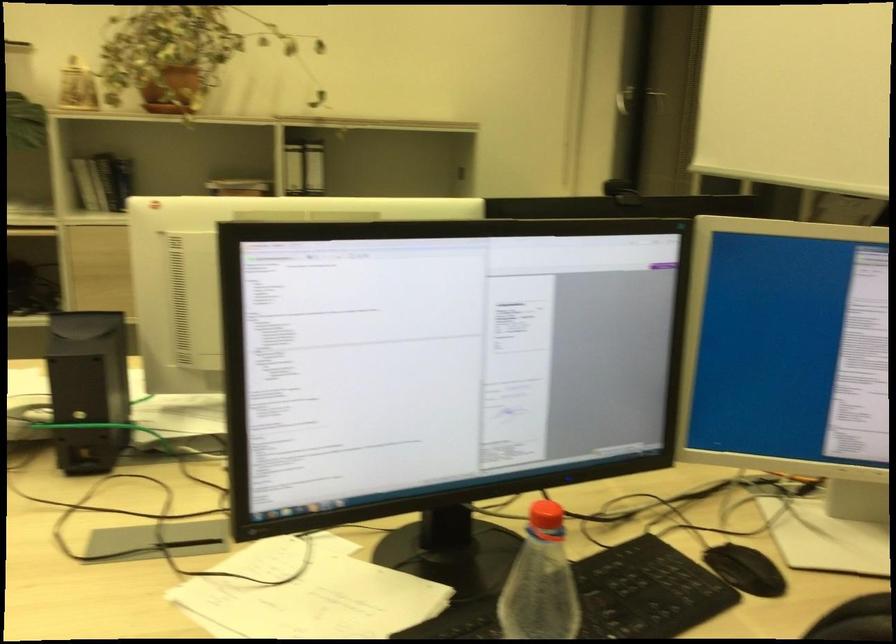
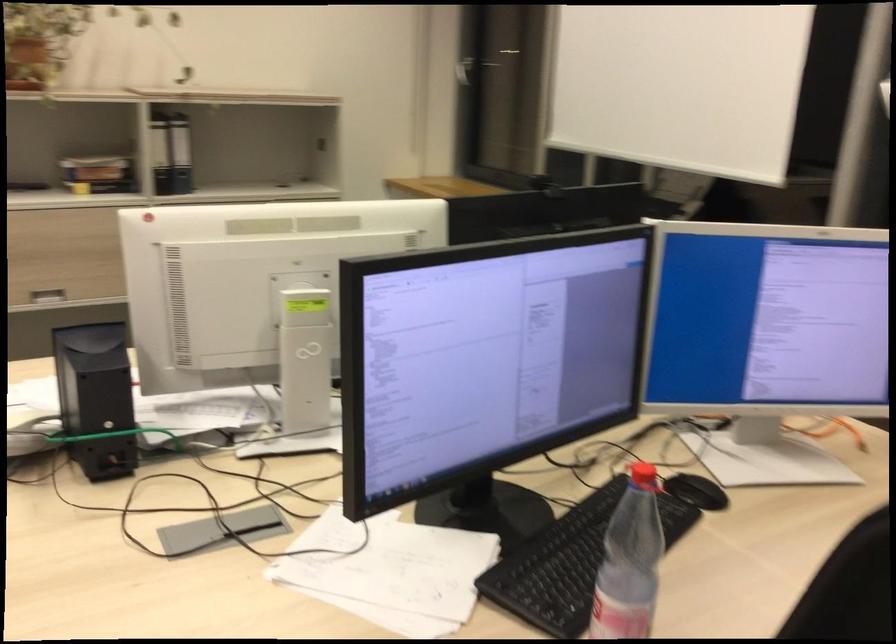
The point at [291,178] is marked in the first image. Where is the corresponding point in the second image?

(160, 153)